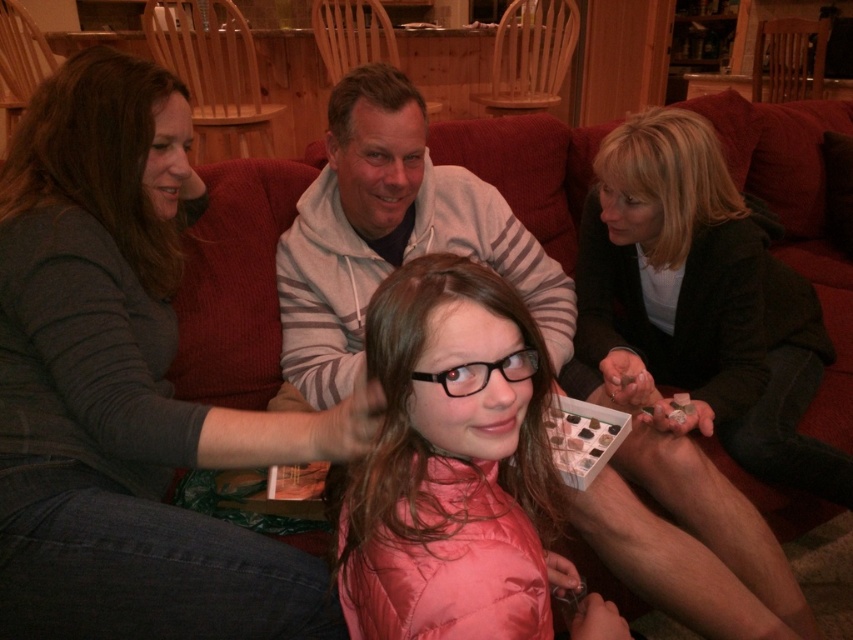
What do you see at coordinates (126, 388) in the screenshot?
I see `gray sweater at upper left` at bounding box center [126, 388].

Between gray sweater at upper left and wooden chair at upper center, which one appears on the left side from the viewer's perspective?

Positioned to the left is wooden chair at upper center.

The height and width of the screenshot is (640, 853). In order to click on gray sweater at upper left in this screenshot , I will do `click(126, 388)`.

This screenshot has height=640, width=853. Find the location of `gray sweater at upper left`. gray sweater at upper left is located at coordinates (126, 388).

Can you confirm if wooden chair at upper center is positioned to the left of wooden armchair at upper center?

Yes, wooden chair at upper center is to the left of wooden armchair at upper center.

Which is in front, point (178, 33) or point (519, 88)?

Point (178, 33) is in front.

Is point (223, 3) behind point (479, 100)?

No, it is not.

This screenshot has width=853, height=640. Find the location of `wooden chair at upper center`. wooden chair at upper center is located at coordinates (212, 67).

Image resolution: width=853 pixels, height=640 pixels. What do you see at coordinates (126, 388) in the screenshot?
I see `gray sweater at upper left` at bounding box center [126, 388].

Does gray sweater at upper left appear on the left side of wooden armchair at upper center?

Correct, you'll find gray sweater at upper left to the left of wooden armchair at upper center.

From the picture: Who is more forward, (196, 435) or (567, 26)?

Positioned in front is point (196, 435).

Identify the location of gray sweater at upper left. Image resolution: width=853 pixels, height=640 pixels. [x=126, y=388].